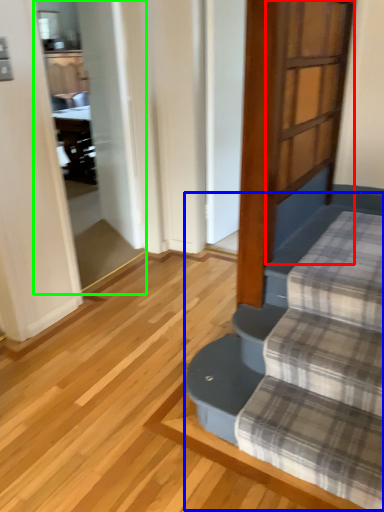
Question: Which object is the farthest from screen door (highlighted by a red box)? Choose among these: stairwell (highlighted by a blue box) or screen door (highlighted by a green box).

Choices:
 (A) stairwell
 (B) screen door

Answer: (B)